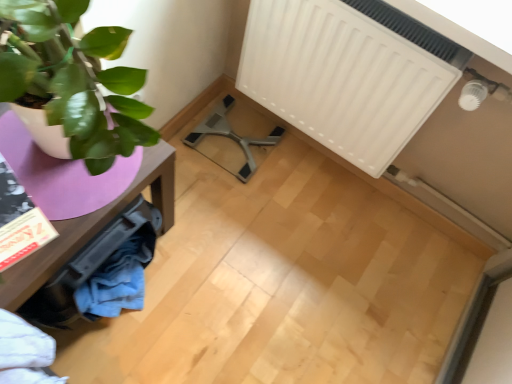
Question: In the image, is white matte radiator at upper right positioned in front of or behind matte purple table at left?

Choices:
 (A) behind
 (B) front

Answer: (A)

Question: Would you say white matte radiator at upper right is inside or outside matte purple table at left?

Choices:
 (A) inside
 (B) outside

Answer: (B)

Question: Based on their relative distances, which object is nearer to the metallic gray swivel chair at center?

Choices:
 (A) matte purple table at left
 (B) white matte radiator at upper right

Answer: (B)

Question: Which object is the farthest from the metallic gray swivel chair at center?

Choices:
 (A) white matte radiator at upper right
 (B) matte purple table at left

Answer: (B)